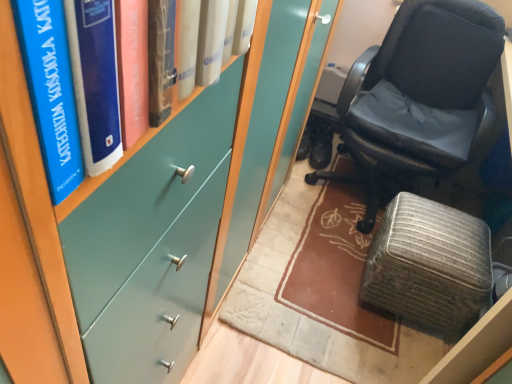
Question: Is black leather chair at right wider than black leather shoes at center?

Choices:
 (A) no
 (B) yes

Answer: (B)

Question: Is black leather chair at right not inside black leather shoes at center?

Choices:
 (A) yes
 (B) no

Answer: (A)

Question: Is black leather chair at right smaller than black leather shoes at center?

Choices:
 (A) yes
 (B) no

Answer: (B)

Question: Can you confirm if black leather chair at right is positioned to the left of black leather shoes at center?

Choices:
 (A) no
 (B) yes

Answer: (A)

Question: Does black leather chair at right appear on the right side of black leather shoes at center?

Choices:
 (A) yes
 (B) no

Answer: (A)

Question: From a real-world perspective, is black leather chair at right physically above black leather shoes at center?

Choices:
 (A) no
 (B) yes

Answer: (B)

Question: From a real-world perspective, is teal matte bookshelf at upper left below textured gray ottoman at lower right?

Choices:
 (A) yes
 (B) no

Answer: (B)

Question: From the image's perspective, is teal matte bookshelf at upper left below textured gray ottoman at lower right?

Choices:
 (A) no
 (B) yes

Answer: (A)

Question: Is teal matte bookshelf at upper left facing away from textured gray ottoman at lower right?

Choices:
 (A) yes
 (B) no

Answer: (B)

Question: Does teal matte bookshelf at upper left appear on the right side of textured gray ottoman at lower right?

Choices:
 (A) no
 (B) yes

Answer: (A)

Question: Is teal matte bookshelf at upper left not inside textured gray ottoman at lower right?

Choices:
 (A) no
 (B) yes

Answer: (B)

Question: From the image's perspective, is teal matte bookshelf at upper left over textured gray ottoman at lower right?

Choices:
 (A) no
 (B) yes

Answer: (B)

Question: Does teal matte bookshelf at upper left lie behind black leather shoes at center?

Choices:
 (A) yes
 (B) no

Answer: (B)